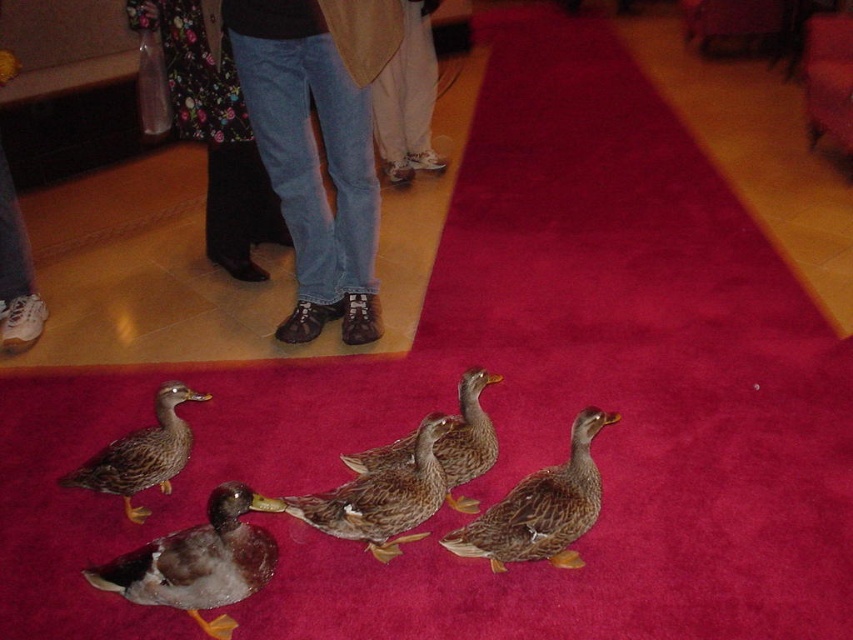
Who is positioned more to the left, floral fabric dress at upper left or white cotton pants at center?

From the viewer's perspective, floral fabric dress at upper left appears more on the left side.

Which is below, floral fabric dress at upper left or white cotton pants at center?

floral fabric dress at upper left

Between point (207, 104) and point (410, 112), which one is positioned in front?

Point (207, 104) is more forward.

Find the location of a particular element. floral fabric dress at upper left is located at coordinates (213, 134).

Is point (195, 620) positioned after point (537, 502)?

No.

This screenshot has width=853, height=640. Identify the location of brown feathered duck at lower left. (199, 561).

Who is more distant from viewer, (434, 1) or (486, 452)?

Positioned behind is point (434, 1).

In the scene shown: Can you confirm if white cotton pants at center is positioned to the right of brown feathered duck at center?

No, white cotton pants at center is not to the right of brown feathered duck at center.

This screenshot has width=853, height=640. Find the location of `white cotton pants at center`. white cotton pants at center is located at coordinates (407, 97).

Identify the location of white cotton pants at center. The image size is (853, 640). (407, 97).